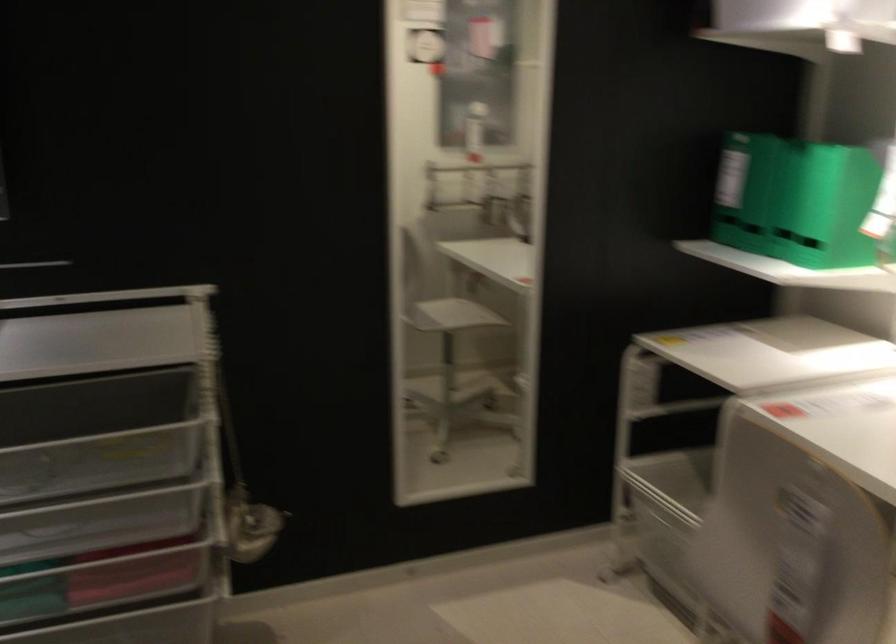
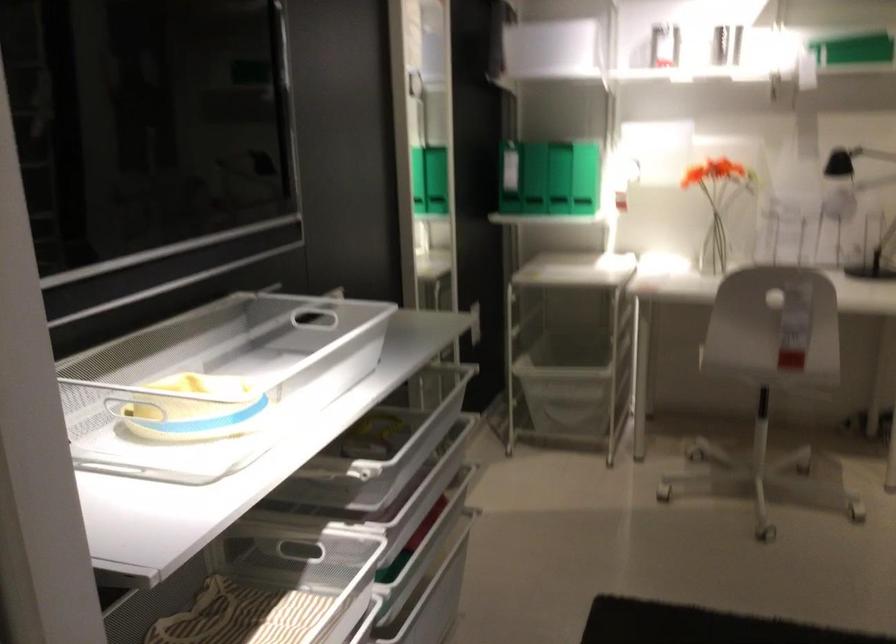
Find the pixel in the second image that matches pixel 739 205 in the first image.

(533, 178)